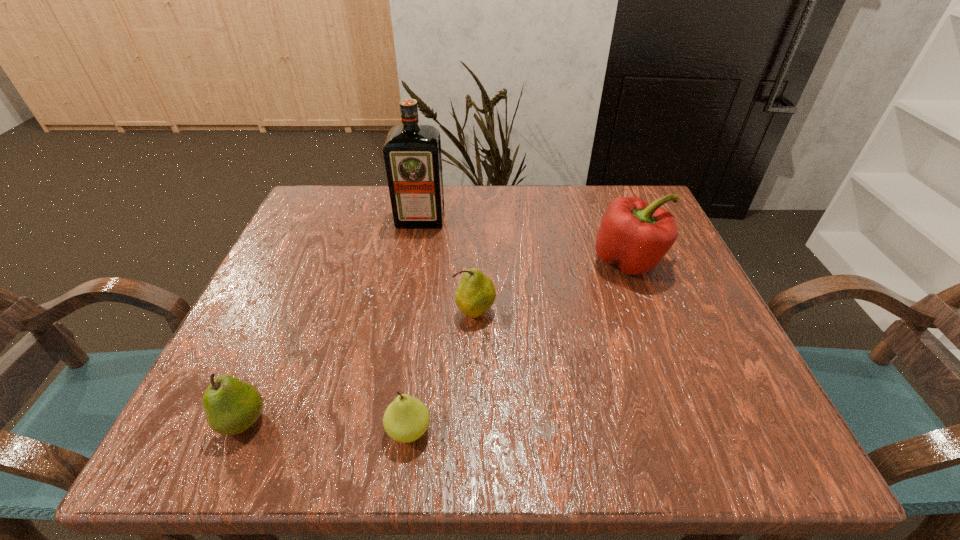
The width and height of the screenshot is (960, 540). Find the location of `unoccupied position between the rightmost pear and the second pear from left to right`. unoccupied position between the rightmost pear and the second pear from left to right is located at coordinates (443, 371).

The width and height of the screenshot is (960, 540). What are the coordinates of `vacant area that lies between the farthest object and the leftmost pear` in the screenshot? It's located at (332, 320).

I want to click on blank region between the leftmost object and the fourth object from left to right, so click(x=359, y=366).

Locate an element on the screen. This screenshot has width=960, height=540. vacant area that lies between the second pear from left to right and the leftmost object is located at coordinates click(326, 426).

Choose which object is the fourth nearest neighbor to the bell pepper. Please provide its 2D coordinates. Your answer should be formatted as a tuple, i.e. [(x, y)], where the tuple contains the x and y coordinates of a point satisfying the conditions above.

[(231, 406)]

Locate an element on the screen. The width and height of the screenshot is (960, 540). the closest object to the leftmost pear is located at coordinates (406, 419).

Locate which pear ranks second in proximity to the second pear from left to right. Please provide its 2D coordinates. Your answer should be formatted as a tuple, i.e. [(x, y)], where the tuple contains the x and y coordinates of a point satisfying the conditions above.

[(231, 406)]

At what (x,y) coordinates should I click in order to perform the action: click on pear that stands as the closest to the third farthest object. Please return your answer as a coordinate pair (x, y). Looking at the image, I should click on (406, 419).

Identify the location of vacant position in the image that satisfies the following two spatial constraints: 1. on the front label of the farthest object; 2. on the right side of the farthest pear. The image size is (960, 540). (404, 312).

Locate an element on the screen. The height and width of the screenshot is (540, 960). free space that satisfies the following two spatial constraints: 1. on the front label of the second pear from right to left; 2. on the left side of the farthest object is located at coordinates (383, 430).